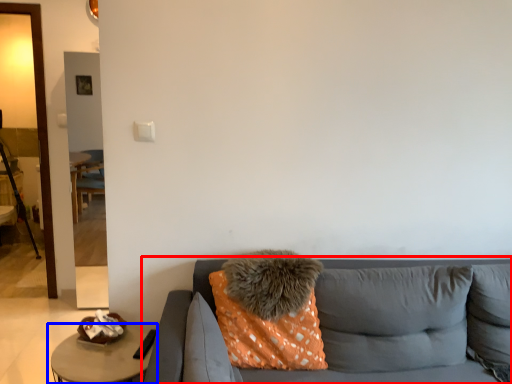
Question: Among these objects, which one is nearest to the camera, studio couch (highlighted by a red box) or table (highlighted by a blue box)?

Choices:
 (A) studio couch
 (B) table

Answer: (A)